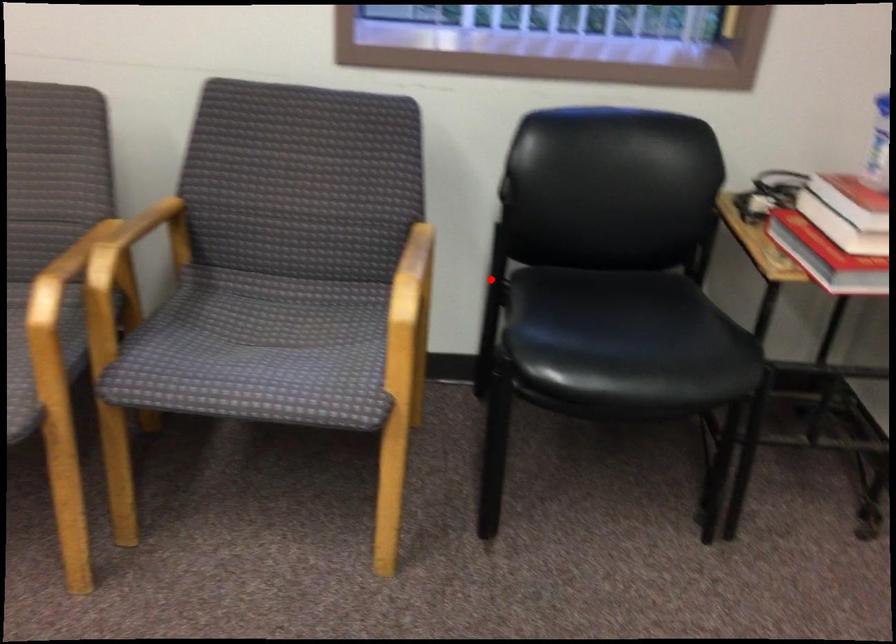
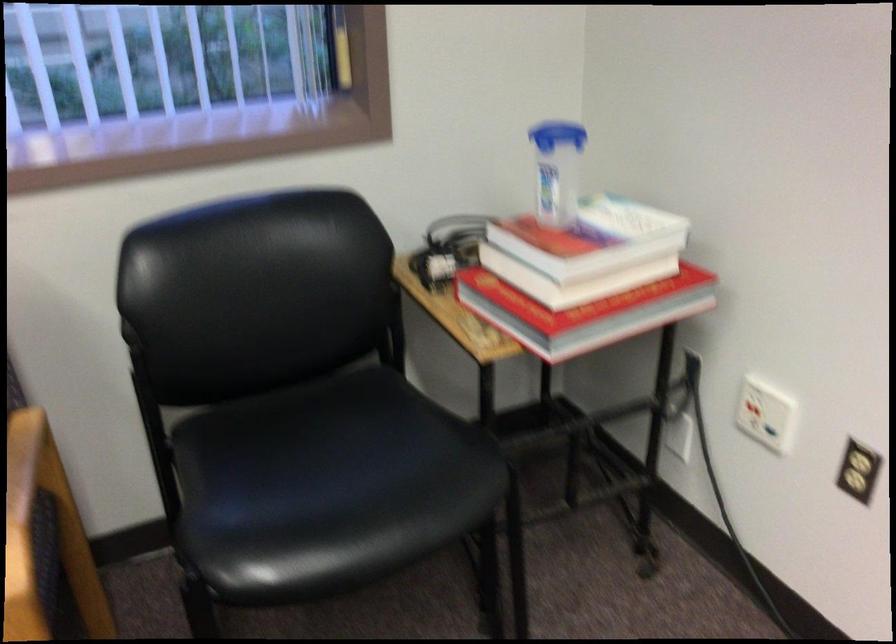
Question: I am providing you with two images of the same scene from different viewpoints. A red point is shown in image1. For the corresponding object point in image2, is it positioned nearer or farther from the camera?

Choices:
 (A) Nearer
 (B) Farther

Answer: (A)